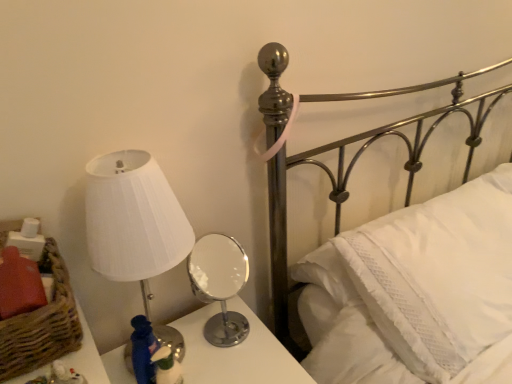
Identify the location of free space above polished chrome mirror at center (from a real-world perspective). (217, 351).